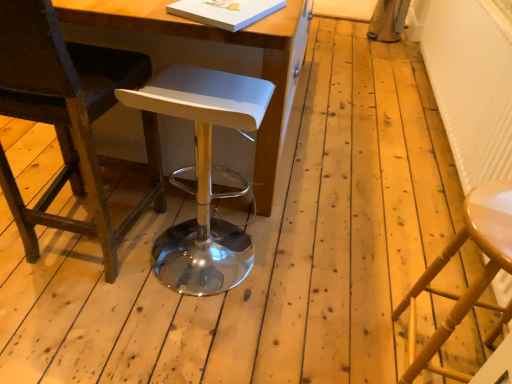
The height and width of the screenshot is (384, 512). What are the coordinates of `free point behind wooden chair at right, positioned as the second stool in left-to-right order` in the screenshot? It's located at (381, 281).